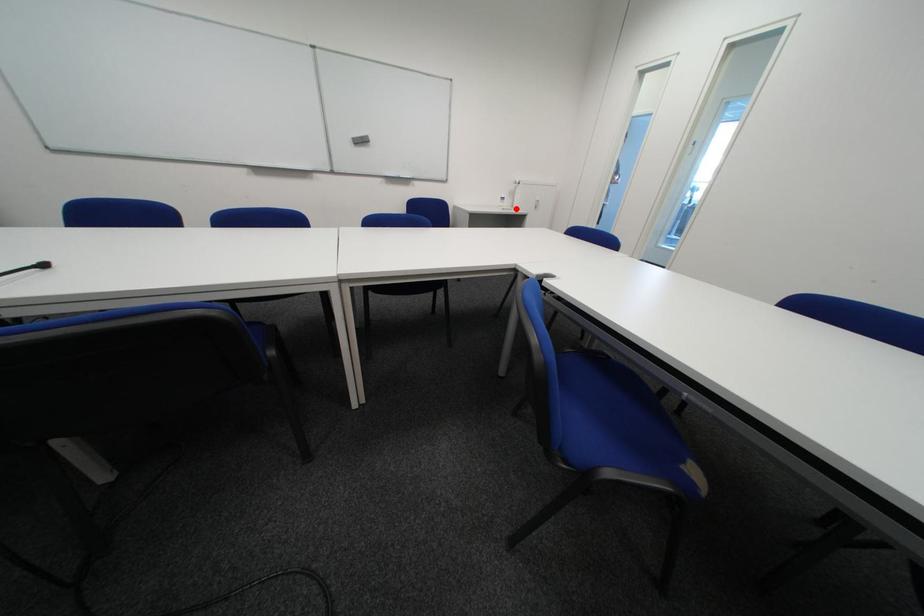
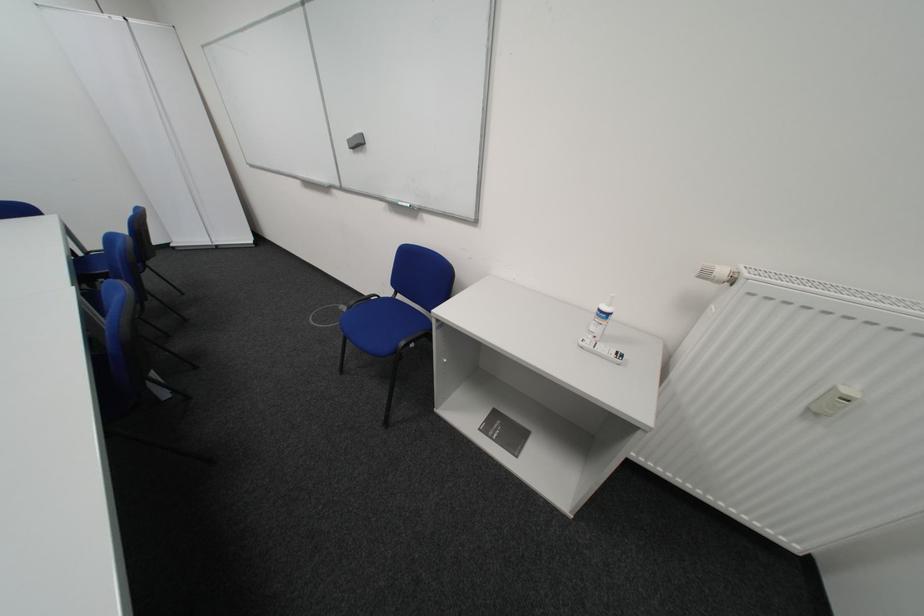
Find the pixel in the second image that matches the highlighted location in the first image.

(599, 345)